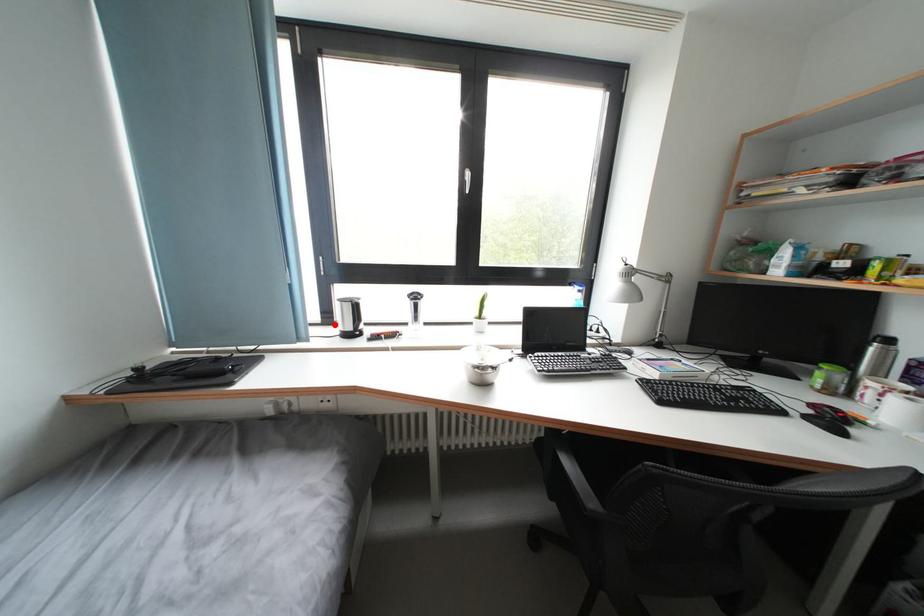
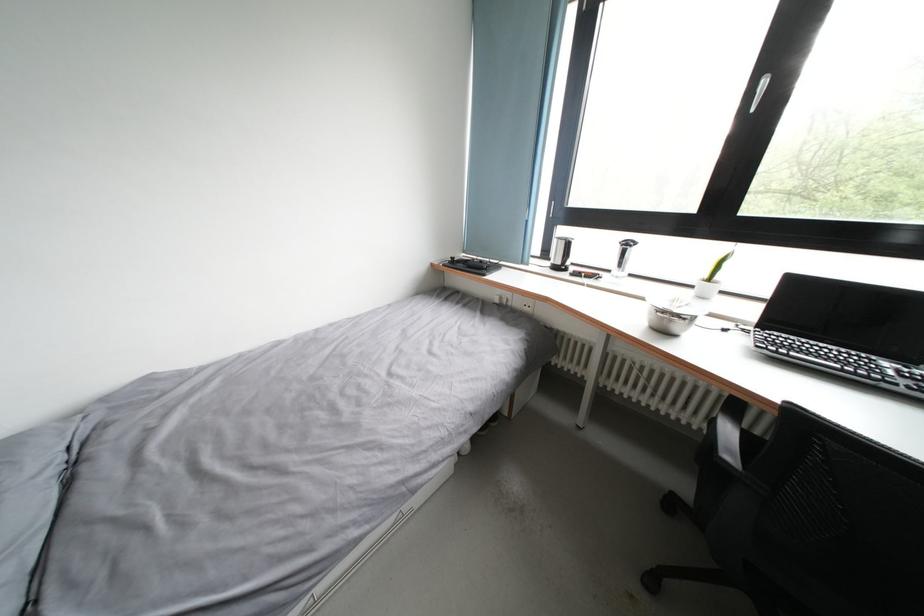
In the second image, find the point that corresponds to the highlighted location in the first image.

(552, 259)